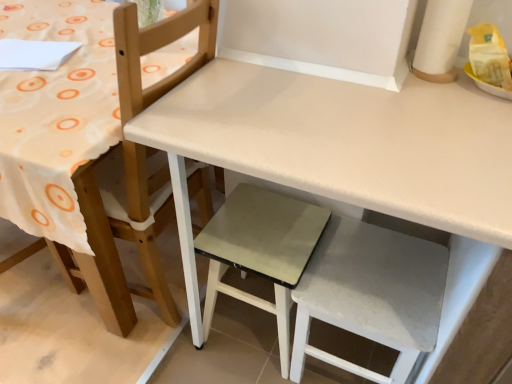
Question: Is white matte chair at upper left far away from white matte table at center?

Choices:
 (A) yes
 (B) no

Answer: (B)

Question: Is white matte chair at upper left positioned beyond the bounds of white matte table at center?

Choices:
 (A) yes
 (B) no

Answer: (A)

Question: From a real-world perspective, is white matte chair at upper left below white matte table at center?

Choices:
 (A) no
 (B) yes

Answer: (A)

Question: Considering the relative sizes of white matte chair at upper left and white matte table at center in the image provided, is white matte chair at upper left bigger than white matte table at center?

Choices:
 (A) no
 (B) yes

Answer: (A)

Question: Is white matte chair at upper left to the left of white matte table at center from the viewer's perspective?

Choices:
 (A) yes
 (B) no

Answer: (A)

Question: Is white matte chair at upper left wider or thinner than white matte table at center?

Choices:
 (A) wide
 (B) thin

Answer: (B)

Question: From a real-world perspective, relative to white matte table at center, is white matte chair at upper left vertically above or below?

Choices:
 (A) below
 (B) above

Answer: (B)

Question: From their relative heights in the image, would you say white matte chair at upper left is taller or shorter than white matte table at center?

Choices:
 (A) short
 (B) tall

Answer: (B)

Question: Is white matte chair at upper left in front of or behind white matte table at center in the image?

Choices:
 (A) front
 (B) behind

Answer: (B)

Question: Choose the correct answer: Is matte gray step stool at center, acting as the second step stool starting from the right, inside white matte table at center or outside it?

Choices:
 (A) outside
 (B) inside

Answer: (B)

Question: From the image's perspective, is matte gray step stool at center, acting as the second step stool starting from the right, above or below white matte table at center?

Choices:
 (A) below
 (B) above

Answer: (A)

Question: From a real-world perspective, is matte gray step stool at center, acting as the second step stool starting from the right, positioned above or below white matte table at center?

Choices:
 (A) below
 (B) above

Answer: (A)

Question: In terms of width, does matte gray step stool at center, which is the first step stool in left-to-right order, look wider or thinner when compared to white matte table at center?

Choices:
 (A) thin
 (B) wide

Answer: (A)

Question: From a real-world perspective, is white fabric step stool at lower right, the 1th step stool from the right, positioned above or below white matte chair at upper left?

Choices:
 (A) above
 (B) below

Answer: (B)

Question: From the image's perspective, is white fabric step stool at lower right, the 1th step stool from the right, positioned above or below white matte chair at upper left?

Choices:
 (A) below
 (B) above

Answer: (A)